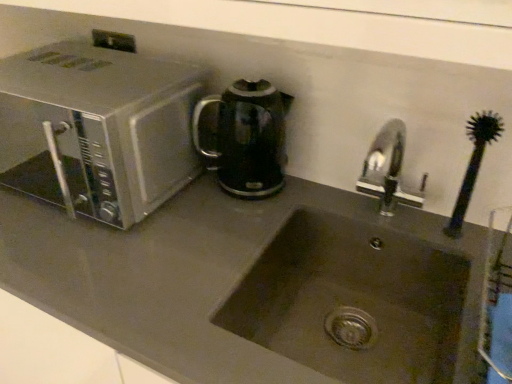
I want to click on free space on the front side of black glossy electric kettle at center, so click(225, 230).